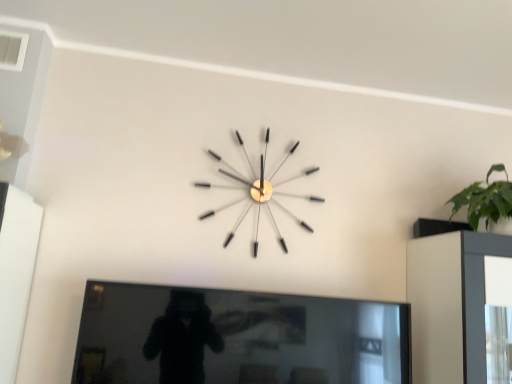
Question: Is black glossy tv at center with clear acrylic clock at center?

Choices:
 (A) yes
 (B) no

Answer: (B)

Question: Does black glossy tv at center have a greater width compared to clear acrylic clock at center?

Choices:
 (A) no
 (B) yes

Answer: (B)

Question: Could you tell me if black glossy tv at center is facing clear acrylic clock at center?

Choices:
 (A) yes
 (B) no

Answer: (B)

Question: From a real-world perspective, is black glossy tv at center on top of clear acrylic clock at center?

Choices:
 (A) yes
 (B) no

Answer: (B)

Question: Considering the relative sizes of black glossy tv at center and clear acrylic clock at center in the image provided, is black glossy tv at center taller than clear acrylic clock at center?

Choices:
 (A) no
 (B) yes

Answer: (A)

Question: Is black glossy tv at center positioned behind clear acrylic clock at center?

Choices:
 (A) yes
 (B) no

Answer: (B)

Question: From the image's perspective, is clear acrylic clock at center located beneath black glossy tv at center?

Choices:
 (A) no
 (B) yes

Answer: (A)

Question: Considering the relative sizes of clear acrylic clock at center and black glossy tv at center in the image provided, is clear acrylic clock at center bigger than black glossy tv at center?

Choices:
 (A) no
 (B) yes

Answer: (A)

Question: Could you tell me if clear acrylic clock at center is turned towards black glossy tv at center?

Choices:
 (A) no
 (B) yes

Answer: (A)

Question: Is clear acrylic clock at center in front of black glossy tv at center?

Choices:
 (A) yes
 (B) no

Answer: (B)

Question: Considering the relative sizes of clear acrylic clock at center and black glossy tv at center in the image provided, is clear acrylic clock at center shorter than black glossy tv at center?

Choices:
 (A) no
 (B) yes

Answer: (A)

Question: From a real-world perspective, is clear acrylic clock at center under black glossy tv at center?

Choices:
 (A) no
 (B) yes

Answer: (A)

Question: Which is correct: clear acrylic clock at center is inside black glossy tv at center, or outside of it?

Choices:
 (A) outside
 (B) inside

Answer: (A)